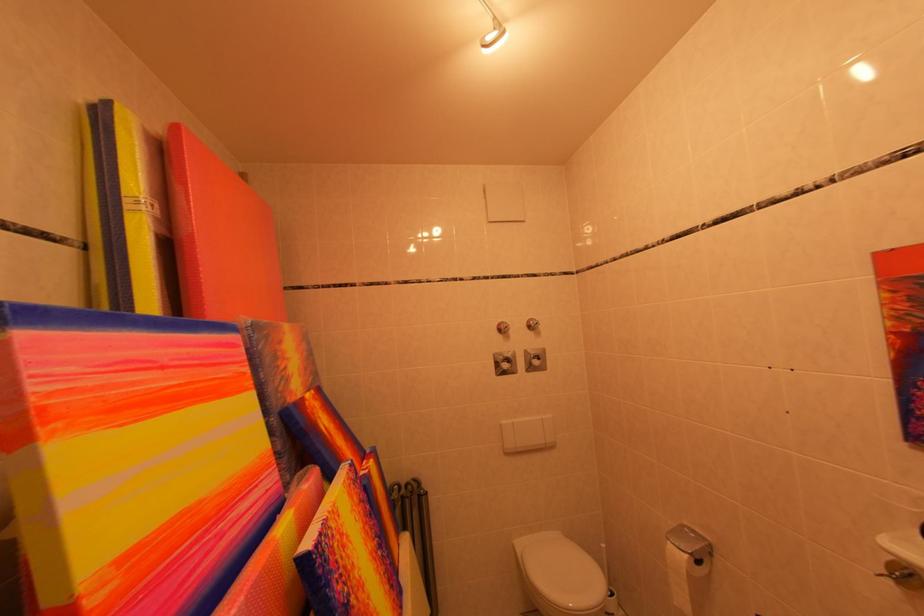
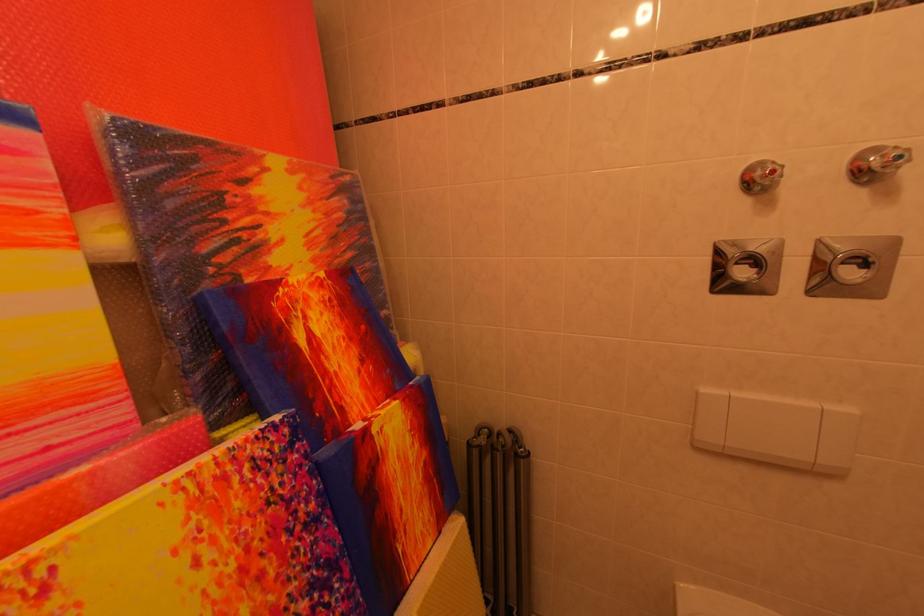
In the second image, find the point that corresponds to (545,328) in the first image.

(907, 161)